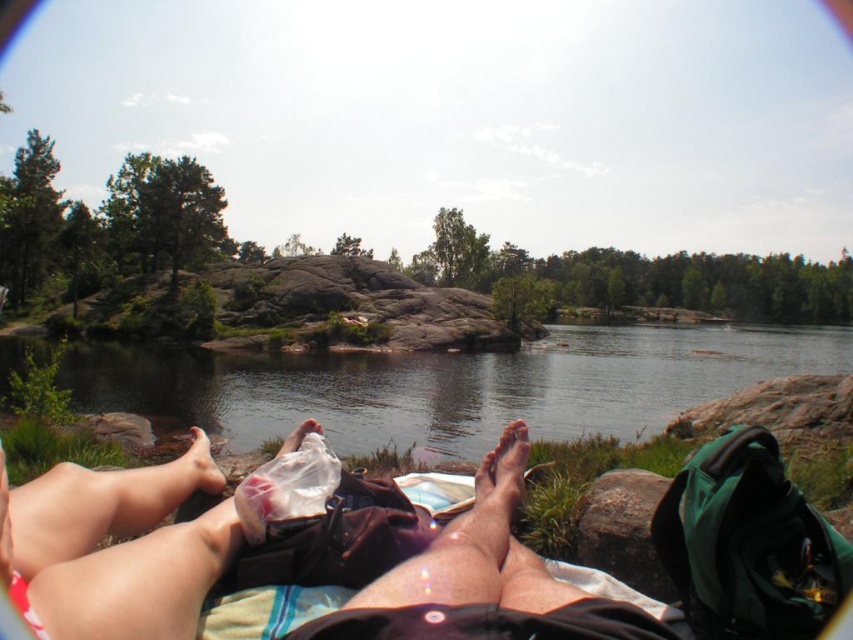
Question: Is clear water at center positioned at the back of matte white foot at lower left?

Choices:
 (A) no
 (B) yes

Answer: (B)

Question: Is clear water at center bigger than rough textured rock at lower right?

Choices:
 (A) no
 (B) yes

Answer: (B)

Question: Which point is closer to the camera?

Choices:
 (A) matte white foot at lower left
 (B) rough textured rock at lower right

Answer: (B)

Question: Which point is farther to the camera?

Choices:
 (A) (202, 433)
 (B) (38, 609)
 (C) (310, 420)
 (D) (512, 472)

Answer: (A)

Question: Can you confirm if dry skin at center is smaller than matte white foot at lower left?

Choices:
 (A) no
 (B) yes

Answer: (B)

Question: Which is farther from the rough textured rock at lower right?

Choices:
 (A) clear water at center
 (B) dry skin at center
 (C) matte white foot at lower left

Answer: (A)